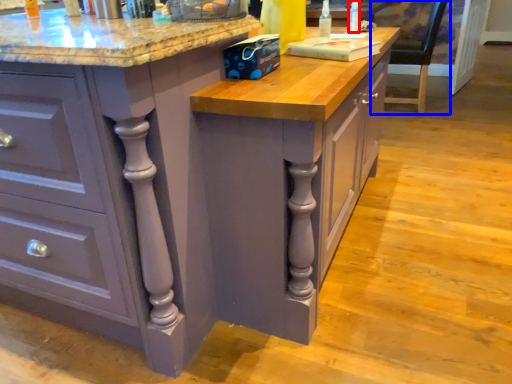
Question: Which point is further to the camera, bottle (highlighted by a red box) or chair (highlighted by a blue box)?

Choices:
 (A) bottle
 (B) chair

Answer: (B)